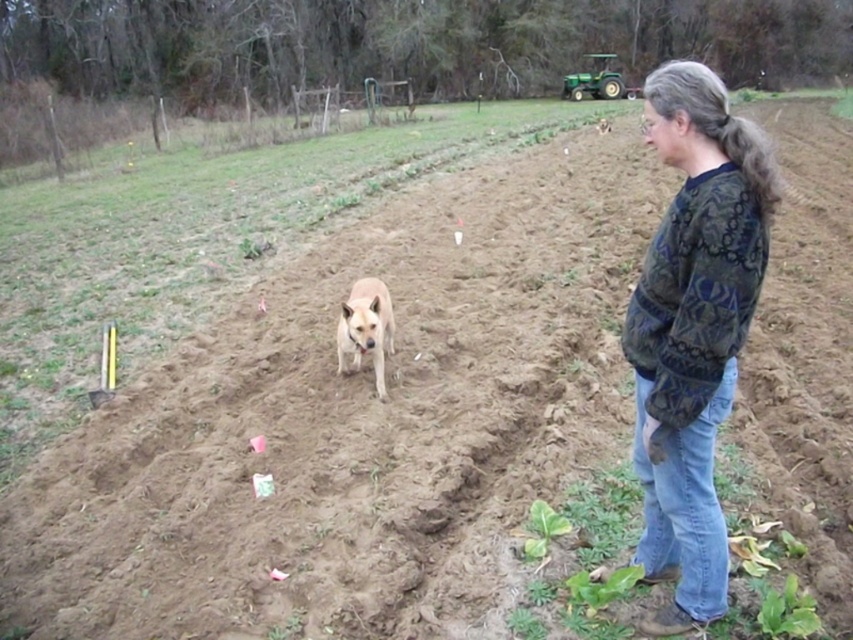
Based on the photo, you are a farmer checking the field. You notice the dark green sweater at right and the light brown fur at center. Which object is narrower in width?

The dark green sweater at right is thinner than the light brown fur at center, so the dark green sweater at right is narrower in width.